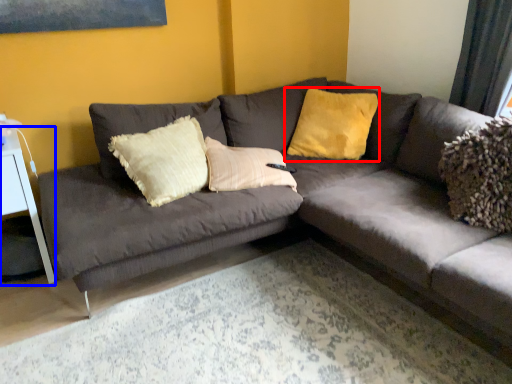
Question: Among these objects, which one is nearest to the camera, pillow (highlighted by a red box) or table (highlighted by a blue box)?

Choices:
 (A) pillow
 (B) table

Answer: (B)